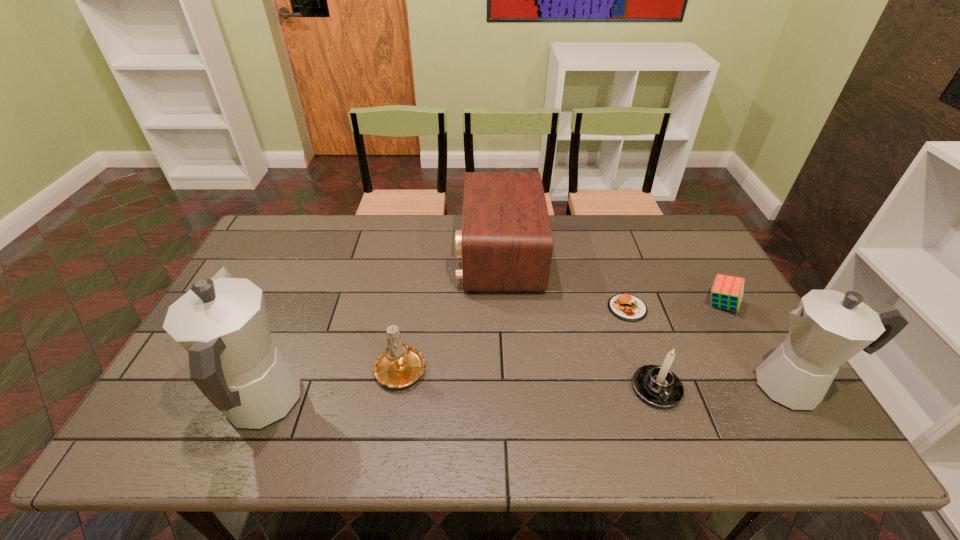
Identify the location of candle holder that is at the near edge. The height and width of the screenshot is (540, 960). (657, 385).

You are a GUI agent. You are given a task and a screenshot of the screen. Output one action in this format:
    pyautogui.click(x=<x>, y=<y>)
    Task: Click on the object positioned at the left edge
    Image resolution: width=960 pixels, height=540 pixels.
    Given the screenshot: What is the action you would take?
    pyautogui.click(x=222, y=322)

The width and height of the screenshot is (960, 540). In order to click on coffeepot located at the right edge in this screenshot , I will do `click(828, 328)`.

Locate an element on the screen. The height and width of the screenshot is (540, 960). cube located in the right edge section of the desktop is located at coordinates (727, 291).

This screenshot has width=960, height=540. What are the coordinates of `object that is at the near left corner` in the screenshot? It's located at (222, 322).

At what (x,y) coordinates should I click in order to perform the action: click on object that is positioned at the near right corner. Please return your answer as a coordinate pair (x, y). The image size is (960, 540). Looking at the image, I should click on (828, 328).

Where is `free region at the far edge of the desktop`? This screenshot has height=540, width=960. free region at the far edge of the desktop is located at coordinates (440, 242).

Image resolution: width=960 pixels, height=540 pixels. What are the coordinates of `vacant space at the near edge` in the screenshot? It's located at (504, 402).

Identify the location of blank space at the left edge. The width and height of the screenshot is (960, 540). (282, 285).

Where is `free region at the right edge`? free region at the right edge is located at coordinates (751, 326).